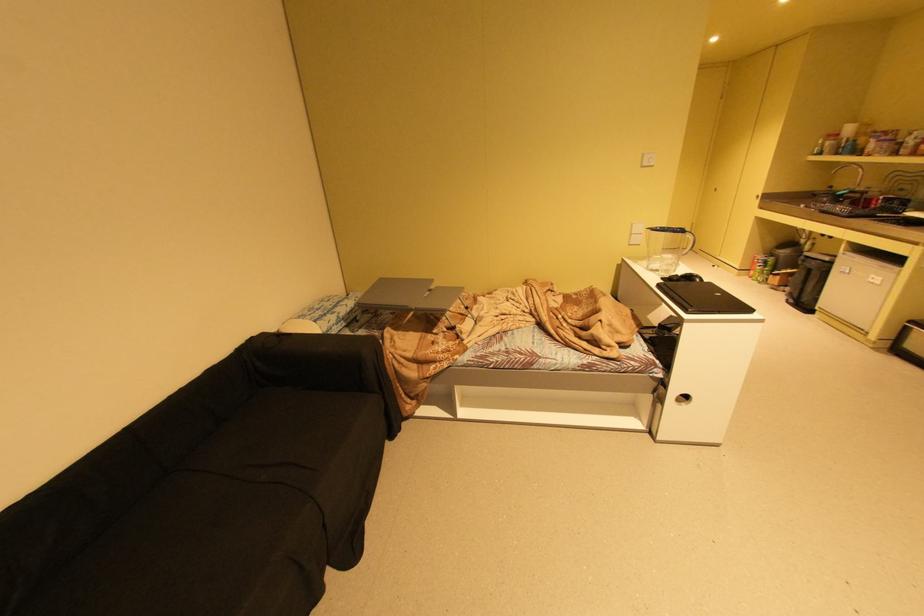
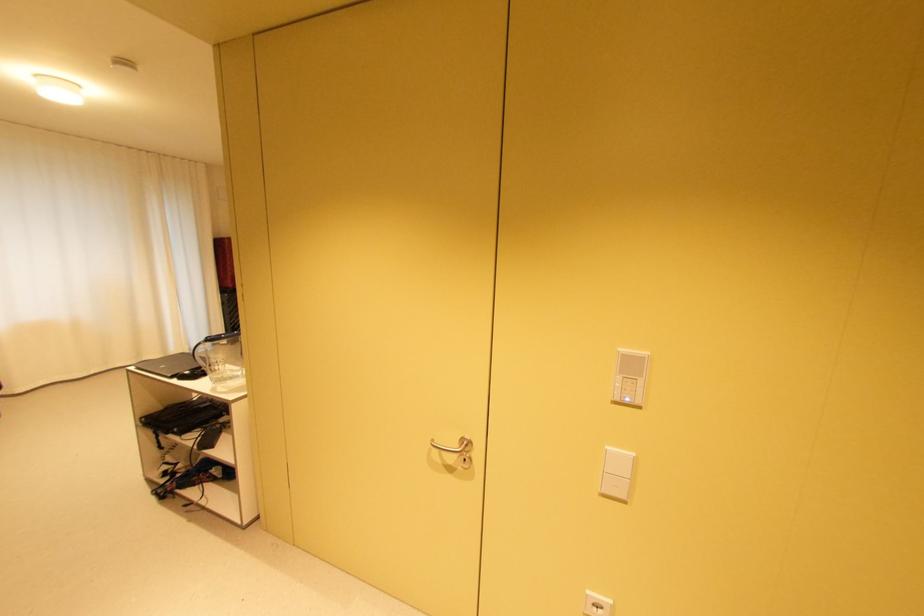
In the second image, find the point that corresponds to pixel 726 294 in the first image.

(171, 367)